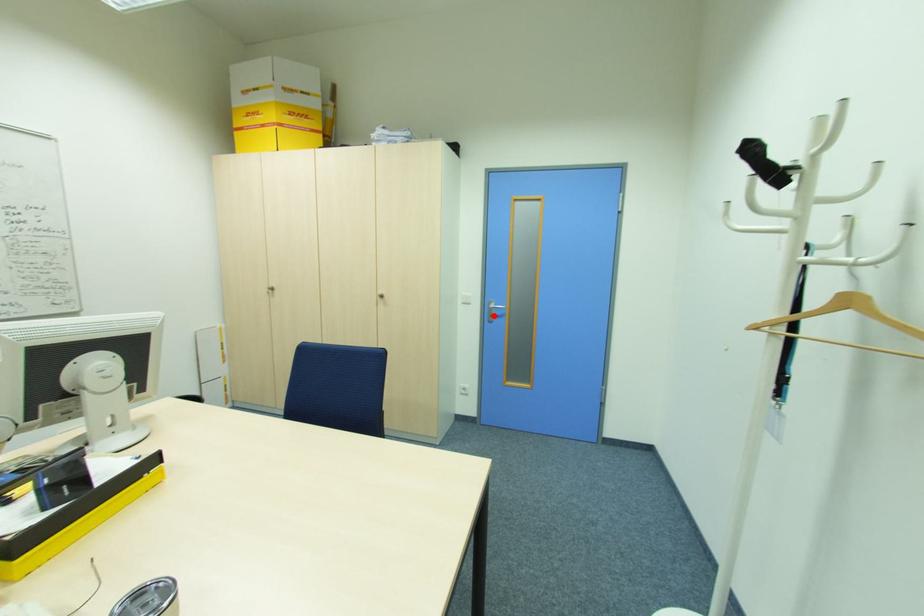
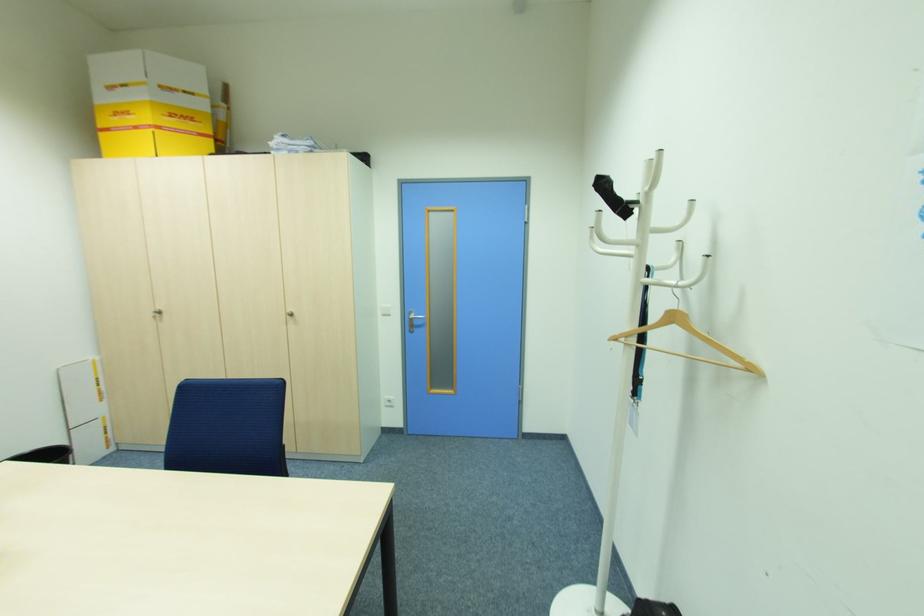
Locate, in the second image, the point that corresponds to the highlighted location in the first image.

(415, 325)